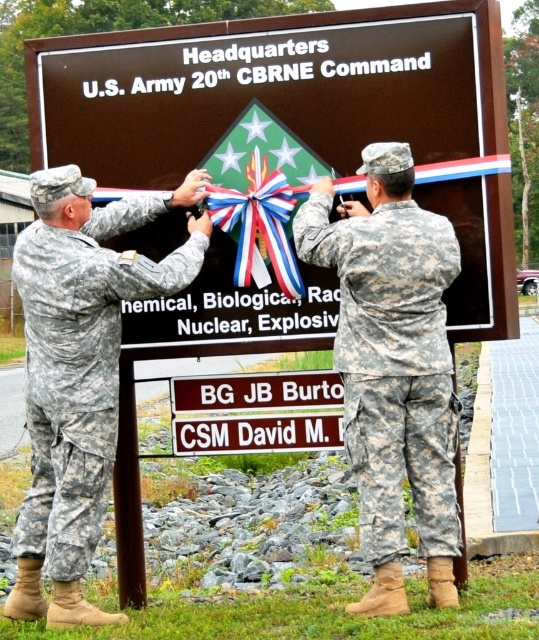
In the scene shown: Based on the scene description, which object is more likely to be wider when viewed from the front? The brown matte sign at center or the camouflage uniform at left?

The brown matte sign at center is wider than the camouflage uniform at left according to the description.

You are a photographer positioned in front of the Headquarters of the U.S. Army 20th CBRNE Command. You want to take a photo of the brown matte sign at center and the camouflage fabric uniform at center. Which object should you focus on first to ensure both are in clear focus?

The brown matte sign at center is further to the viewer than the camouflage fabric uniform at center. To ensure both are in clear focus, you should focus on the brown matte sign at center first since it is closer to the camera, allowing the uniform to remain in focus as well.